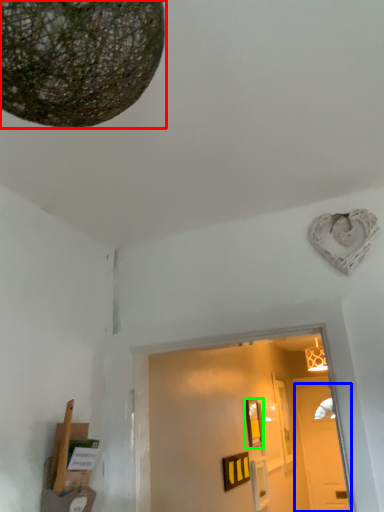
Question: Which is nearer to the lamp (highlighted by a red box)? door (highlighted by a blue box) or picture frame (highlighted by a green box).

Choices:
 (A) door
 (B) picture frame

Answer: (B)